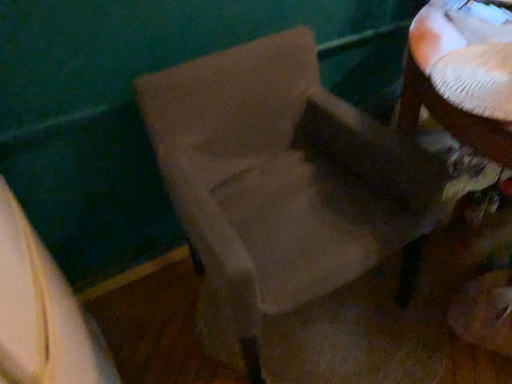
Question: Is suede-like beige chair at center spatially inside white textured table at upper right, or outside of it?

Choices:
 (A) inside
 (B) outside

Answer: (B)

Question: Looking at their shapes, would you say suede-like beige chair at center is wider or thinner than white textured table at upper right?

Choices:
 (A) thin
 (B) wide

Answer: (B)

Question: Estimate the real-world distances between objects in this image. Which object is closer to the suede-like beige chair at center?

Choices:
 (A) white textured table at upper right
 (B) white fabric at lower left

Answer: (A)

Question: Estimate the real-world distances between objects in this image. Which object is farther from the white textured table at upper right?

Choices:
 (A) suede-like beige chair at center
 (B) white fabric at lower left

Answer: (B)